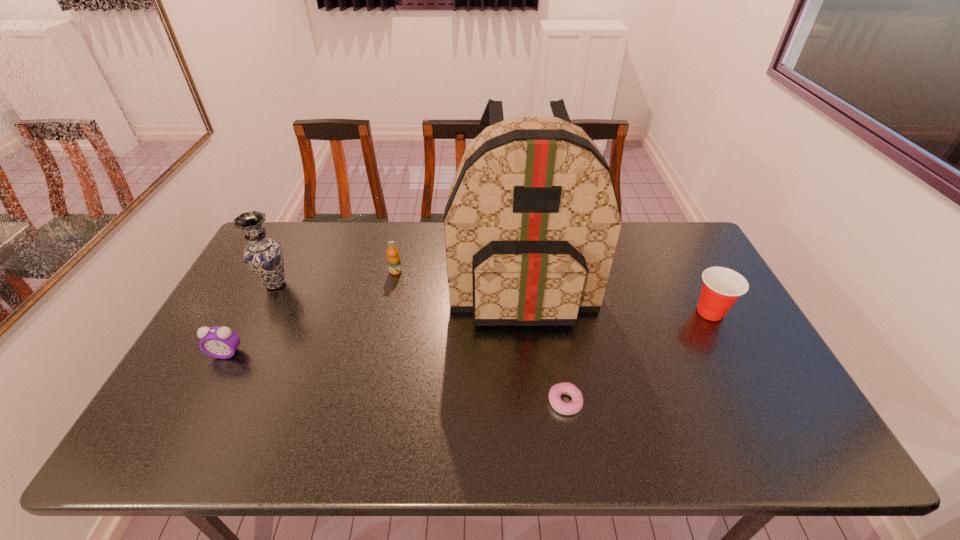
Image resolution: width=960 pixels, height=540 pixels. I want to click on vacant space at the left edge, so click(201, 386).

What are the coordinates of `blank area at the right edge` in the screenshot? It's located at (735, 382).

The image size is (960, 540). What are the coordinates of `free location at the far left corner of the desktop` in the screenshot? It's located at (278, 224).

You are a GUI agent. You are given a task and a screenshot of the screen. Output one action in this format:
    pyautogui.click(x=<x>, y=<y>)
    Task: Click on the free space that is in between the nearest object and the cup
    This screenshot has width=960, height=540.
    Given the screenshot: What is the action you would take?
    pyautogui.click(x=637, y=357)

The height and width of the screenshot is (540, 960). In order to click on vacant space in between the alarm clock and the orange juice in this screenshot , I will do `click(311, 313)`.

This screenshot has width=960, height=540. Find the location of `free space between the second nearest object and the orange juice`. free space between the second nearest object and the orange juice is located at coordinates [311, 313].

Locate an element on the screen. This screenshot has height=540, width=960. free point between the fourth object from right to left and the fifth farthest object is located at coordinates (311, 313).

Find the location of `free area in between the shortest object and the vase`. free area in between the shortest object and the vase is located at coordinates (420, 343).

Locate an element on the screen. This screenshot has height=540, width=960. free space between the backpack and the pastry is located at coordinates (543, 340).

You are a GUI agent. You are given a task and a screenshot of the screen. Output one action in this format:
    pyautogui.click(x=<x>, y=<y>)
    Task: Click on the vacant space in between the alarm clock and the nearest object
    Image resolution: width=960 pixels, height=540 pixels.
    Given the screenshot: What is the action you would take?
    pyautogui.click(x=396, y=377)